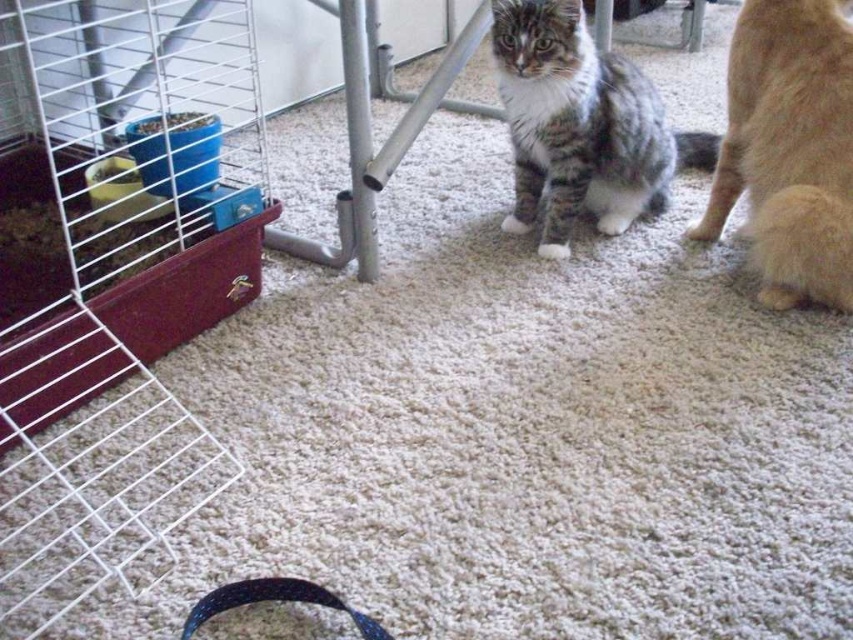
Which is above, fluffy orange cat at lower right or tabby fur cat at center?

tabby fur cat at center is higher up.

Can you confirm if fluffy orange cat at lower right is bigger than tabby fur cat at center?

Actually, fluffy orange cat at lower right might be smaller than tabby fur cat at center.

Between point (763, 90) and point (546, 20), which one is positioned in front?

Point (546, 20) is more forward.

At what (x,y) coordinates should I click in order to perform the action: click on fluffy orange cat at lower right. Please return your answer as a coordinate pair (x, y). This screenshot has width=853, height=640. Looking at the image, I should click on (788, 148).